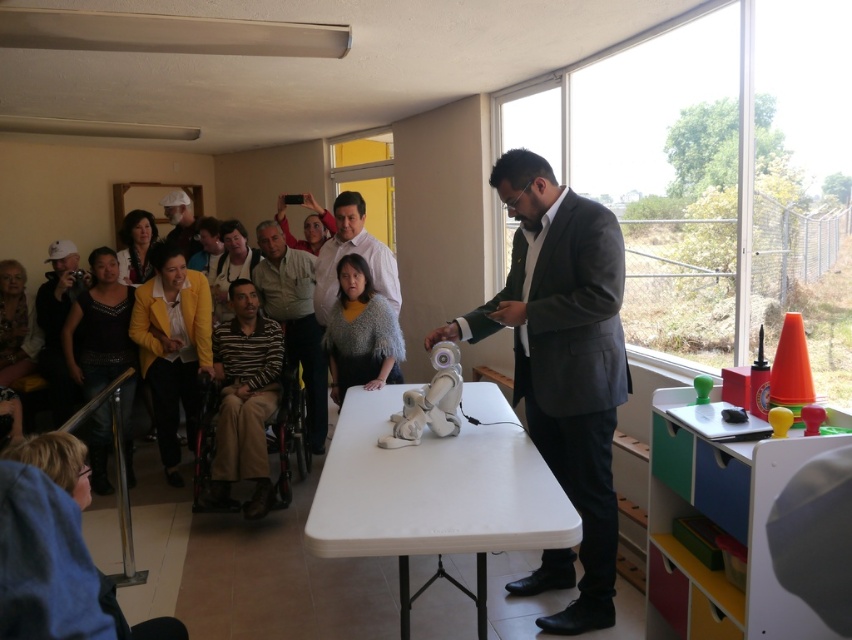
Is point (579, 604) more distant than point (358, 529)?

Yes, point (579, 604) is behind point (358, 529).

Can you confirm if dark gray suit at center is taller than white plastic table at center?

Yes.

Is point (448, 330) positioned after point (567, 506)?

Yes, point (448, 330) is behind point (567, 506).

Where is `dark gray suit at center`? dark gray suit at center is located at coordinates (563, 356).

Consider the image. Who is higher up, white plastic table at center or white matte robot at center?

white matte robot at center is higher up.

In the scene shown: Between white plastic table at center and white matte robot at center, which one has more height?

Standing taller between the two is white plastic table at center.

Is point (377, 433) positioned after point (401, 424)?

Yes, it is.

You are a GUI agent. You are given a task and a screenshot of the screen. Output one action in this format:
    pyautogui.click(x=<x>, y=<y>)
    Task: Click on the white plastic table at center
    The image size is (852, 640).
    Given the screenshot: What is the action you would take?
    pyautogui.click(x=435, y=492)

Is striped cotton shirt at center above white shirt at center?

No, striped cotton shirt at center is not above white shirt at center.

Does striped cotton shirt at center have a lesser height compared to white shirt at center?

In fact, striped cotton shirt at center may be taller than white shirt at center.

Identify the location of striped cotton shirt at center. (294, 320).

Where is `striped cotton shirt at center`? striped cotton shirt at center is located at coordinates (294, 320).